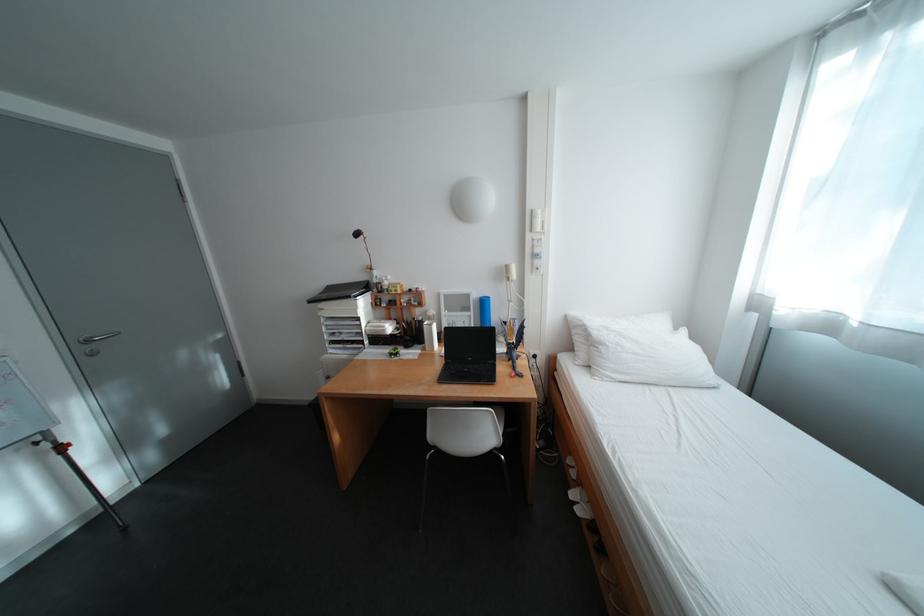
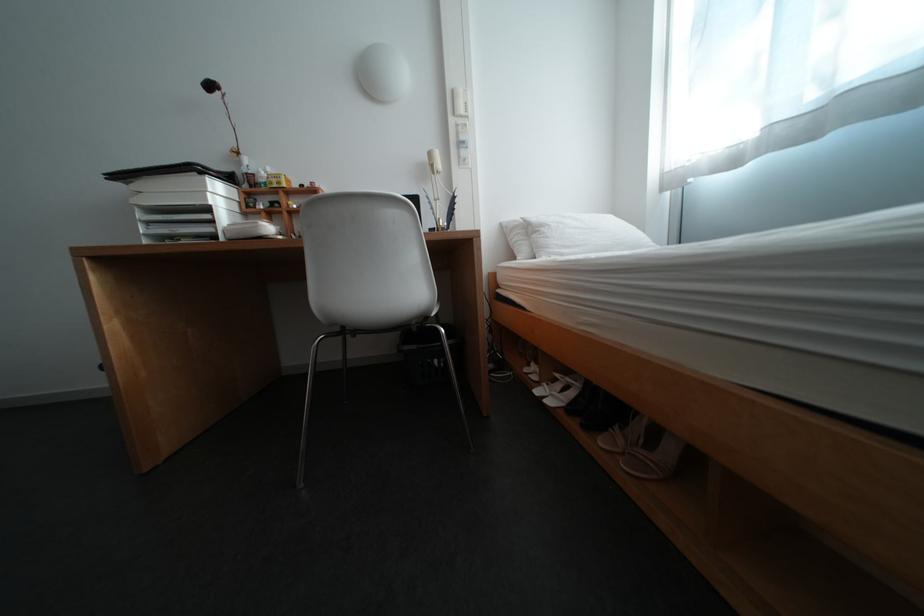
Question: The images are taken continuously from a first-person perspective. In which direction are you moving?

Choices:
 (A) Left
 (B) Right
 (C) Forward
 (D) Backward

Answer: (C)